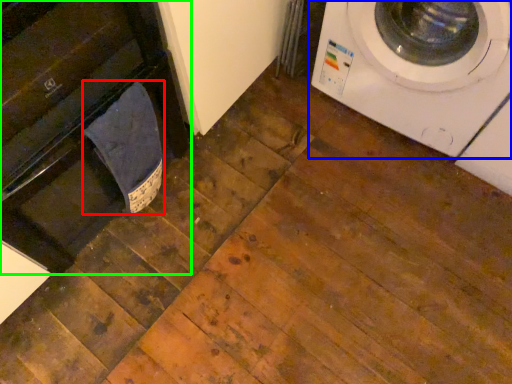
Question: Based on their relative distances, which object is farther from laundry (highlighted by a red box)? Choose from washing machine (highlighted by a blue box) and dish washer (highlighted by a green box).

Choices:
 (A) washing machine
 (B) dish washer

Answer: (A)